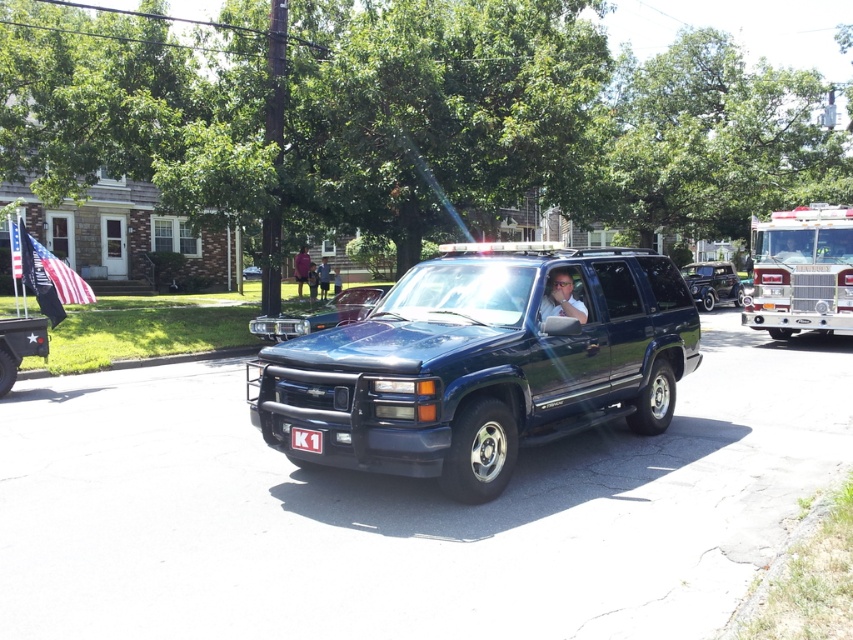
Question: Is glossy dark blue suv at center in front of shiny black car at center?

Choices:
 (A) no
 (B) yes

Answer: (B)

Question: Among these points, which one is nearest to the camera?

Choices:
 (A) (276, 333)
 (B) (581, 310)
 (C) (500, 346)

Answer: (C)

Question: Which point is farther to the camera?

Choices:
 (A) shiny black car at center
 (B) matte black shirt at center
 (C) shiny blue suv at center

Answer: (C)

Question: Does shiny blue car at center appear over shiny blue suv at center?

Choices:
 (A) no
 (B) yes

Answer: (A)

Question: Which object is the farthest from the dark blue uniform at center?

Choices:
 (A) black plastic license plate at center
 (B) red metallic fire truck at right

Answer: (A)

Question: Does glossy dark blue suv at center appear under shiny blue suv at center?

Choices:
 (A) yes
 (B) no

Answer: (A)